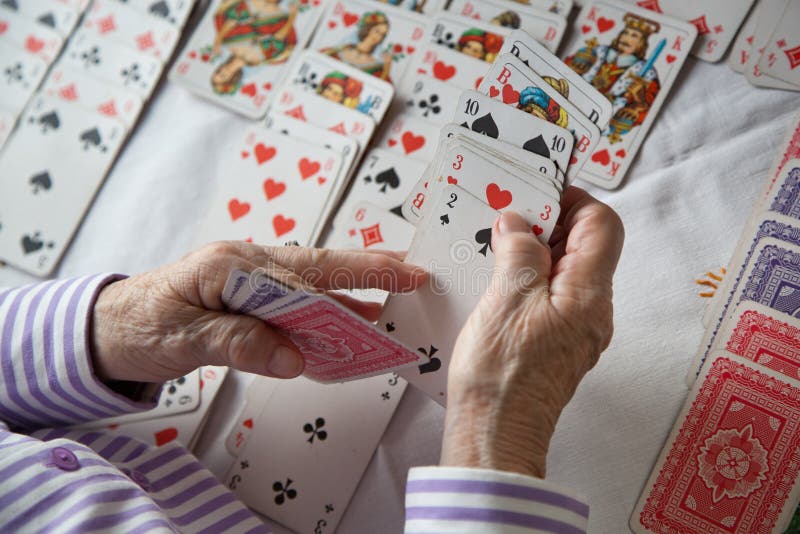
Where is `tablecloth`? tablecloth is located at coordinates (644, 359).